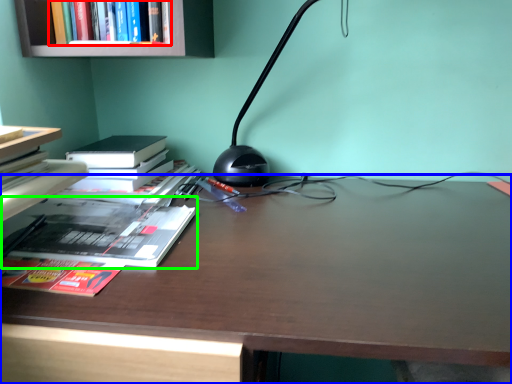
Question: Based on their relative distances, which object is farther from book (highlighted by a red box)? Choose from desk (highlighted by a blue box) and book (highlighted by a green box).

Choices:
 (A) desk
 (B) book

Answer: (A)